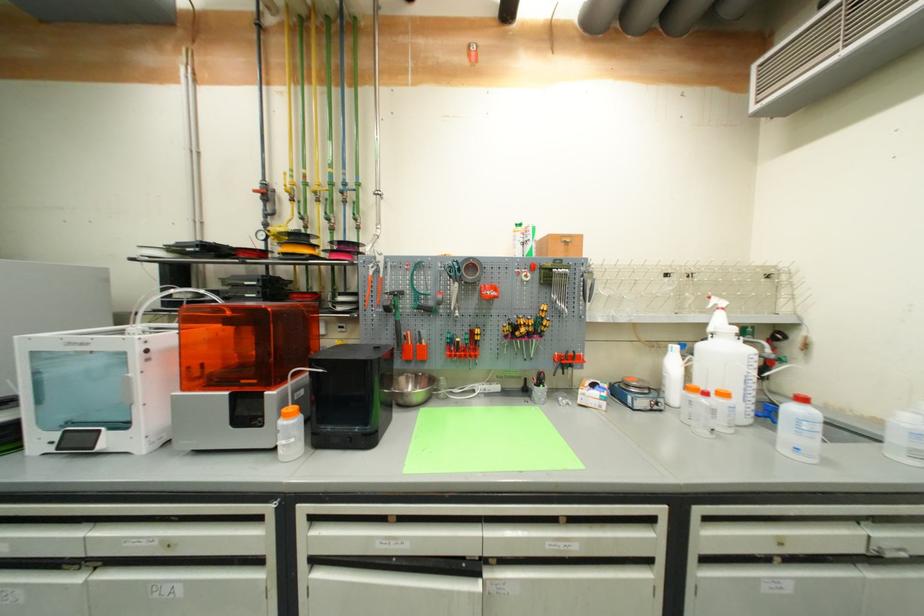
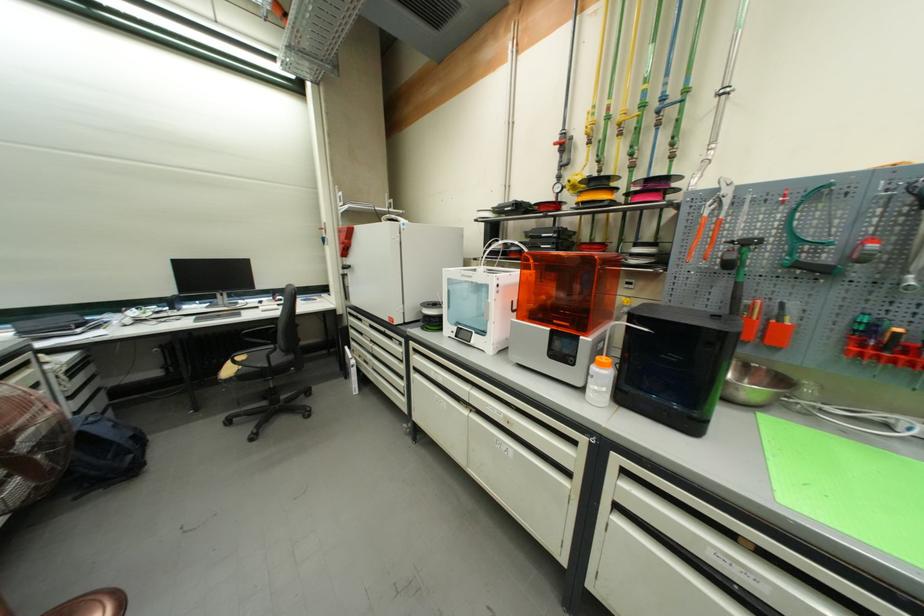
Locate, in the second image, the point that corresponds to [400,323] in the first image.

(742, 285)